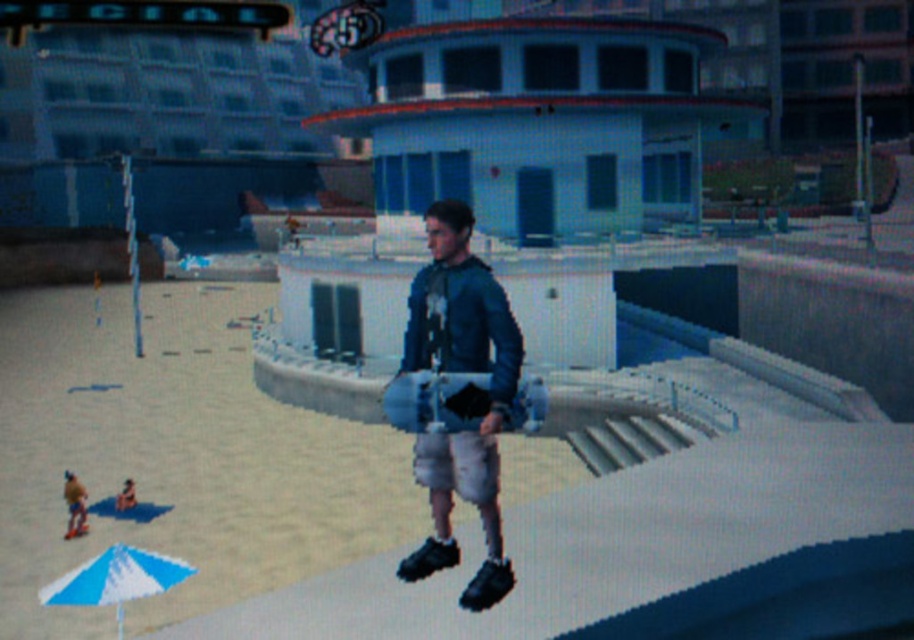
Question: Estimate the real-world distances between objects in this image. Which object is closer to the blue and white striped umbrella at lower left?

Choices:
 (A) matte blue skateboard at center
 (B) white cotton shorts at center
 (C) matte gray skateboard at center
 (D) smooth tan skin at lower left

Answer: (B)

Question: Which point is farther from the camera taking this photo?

Choices:
 (A) (426, 465)
 (B) (131, 481)
 (C) (441, 524)

Answer: (B)

Question: Does white cotton shorts at center appear over light brown fabric shorts at lower left?

Choices:
 (A) yes
 (B) no

Answer: (A)

Question: Estimate the real-world distances between objects in this image. Which object is farther from the light brown fabric shorts at lower left?

Choices:
 (A) smooth tan skin at lower left
 (B) blue and white striped umbrella at lower left
 (C) matte blue skateboard at center
 (D) matte gray skateboard at center

Answer: (C)

Question: Is matte blue skateboard at center further to the viewer compared to blue and white striped umbrella at lower left?

Choices:
 (A) no
 (B) yes

Answer: (A)

Question: Is matte gray skateboard at center below blue and white striped umbrella at lower left?

Choices:
 (A) yes
 (B) no

Answer: (B)